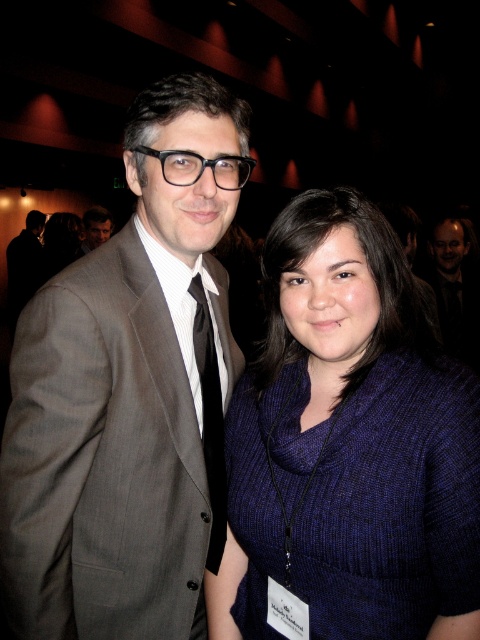
You are organizing a photo shoot and need to place a large backdrop behind both the knitted dark blue sweater at center and the dark gray suit at center. Based on their widths, which object requires more space to accommodate its width?

The knitted dark blue sweater at center might be wider than dark gray suit at center, so it requires more space to accommodate its width.

In the scene shown: You are at a formal event and need to identify the person wearing the matte gray suit at center and the black satin tie at center. Which one is on the left side?

The matte gray suit at center is positioned on the left side of the black satin tie at center.

You are at a conference and need to identify the person wearing both the dark gray suit at center and the black satin tie at center. Based on their positions, which one is on the left side?

The black satin tie at center is on the left side since the dark gray suit at center is positioned to its right.